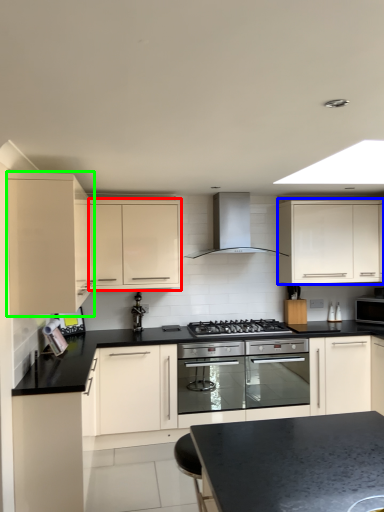
Question: Considering the real-world distances, which object is closest to cabinetry (highlighted by a red box)? cabinetry (highlighted by a blue box) or cabinetry (highlighted by a green box).

Choices:
 (A) cabinetry
 (B) cabinetry

Answer: (B)